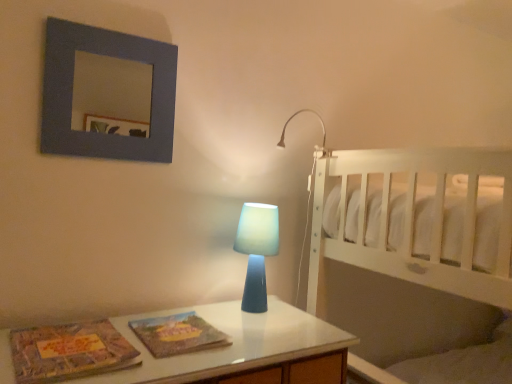
Question: Is matte gray picture frame at upper left at the back of white wooden bed at right?

Choices:
 (A) yes
 (B) no

Answer: (B)

Question: Is matte gray picture frame at upper left completely or partially inside white wooden bed at right?

Choices:
 (A) no
 (B) yes

Answer: (A)

Question: Is white wooden bed at right further to camera compared to matte gray picture frame at upper left?

Choices:
 (A) yes
 (B) no

Answer: (B)

Question: Considering the relative sizes of white wooden bed at right and matte gray picture frame at upper left in the image provided, is white wooden bed at right smaller than matte gray picture frame at upper left?

Choices:
 (A) no
 (B) yes

Answer: (A)

Question: From a real-world perspective, is white wooden bed at right on matte gray picture frame at upper left?

Choices:
 (A) yes
 (B) no

Answer: (B)

Question: From a real-world perspective, is matte gray picture frame at upper left positioned above or below matte cardboard magazine at lower left, which is the second magazine from right to left?

Choices:
 (A) above
 (B) below

Answer: (A)

Question: In the image, is matte gray picture frame at upper left on the left side or the right side of matte cardboard magazine at lower left, which is the second magazine from right to left?

Choices:
 (A) left
 (B) right

Answer: (B)

Question: From the image's perspective, is matte gray picture frame at upper left located above or below matte cardboard magazine at lower left, which appears as the 1th magazine when viewed from the left?

Choices:
 (A) below
 (B) above

Answer: (B)

Question: Is matte gray picture frame at upper left in front of or behind matte cardboard magazine at lower left, which appears as the 1th magazine when viewed from the left, in the image?

Choices:
 (A) behind
 (B) front

Answer: (A)

Question: In the image, is textured paper magazine at center, which appears as the first magazine when viewed from the right, positioned in front of or behind matte gray picture frame at upper left?

Choices:
 (A) front
 (B) behind

Answer: (A)

Question: Considering the positions of point (166, 355) and point (100, 43), is point (166, 355) closer or farther from the camera than point (100, 43)?

Choices:
 (A) farther
 (B) closer

Answer: (B)

Question: Considering the positions of textured paper magazine at center, which appears as the first magazine when viewed from the right, and matte gray picture frame at upper left in the image, is textured paper magazine at center, which appears as the first magazine when viewed from the right, taller or shorter than matte gray picture frame at upper left?

Choices:
 (A) tall
 (B) short

Answer: (B)

Question: From the image's perspective, is textured paper magazine at center, placed as the second magazine when sorted from left to right, above or below matte gray picture frame at upper left?

Choices:
 (A) above
 (B) below

Answer: (B)

Question: In terms of width, does textured paper magazine at center, which appears as the first magazine when viewed from the right, look wider or thinner when compared to blue translucent lamp at upper right, which is the second lamp from bottom to top?

Choices:
 (A) wide
 (B) thin

Answer: (A)

Question: Is point (186, 329) positioned closer to the camera than point (322, 119)?

Choices:
 (A) closer
 (B) farther

Answer: (A)